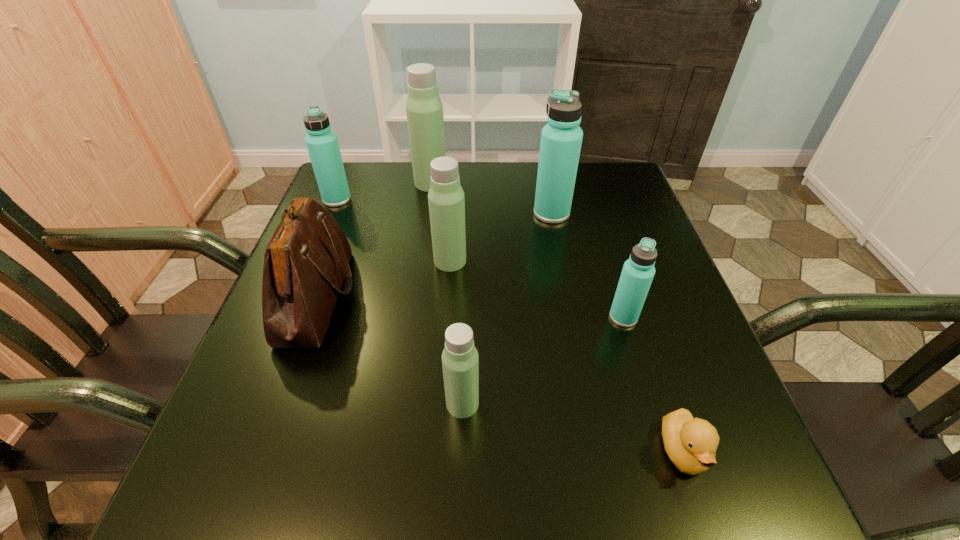
Locate an element on the screen. The image size is (960, 540). the smallest light thermos bottle is located at coordinates (460, 361).

Image resolution: width=960 pixels, height=540 pixels. Find the location of `the nearest thermos bottle`. the nearest thermos bottle is located at coordinates (460, 361).

Find the location of a particular element. This screenshot has width=960, height=540. duckling is located at coordinates (691, 443).

You are a GUI agent. You are given a task and a screenshot of the screen. Output one action in this format:
    pyautogui.click(x=<x>, y=<y>)
    Task: Click on the shortest object
    
    Given the screenshot: What is the action you would take?
    pyautogui.click(x=691, y=443)

Where is `vacant region located 0.290m on the right of the farthest light thermos bottle`? The width and height of the screenshot is (960, 540). vacant region located 0.290m on the right of the farthest light thermos bottle is located at coordinates (555, 183).

The image size is (960, 540). I want to click on free space located on the left of the second aqua thermos bottle from right to left, so click(x=510, y=213).

Identify the location of vacant space located 0.120m on the right of the leftmost aqua thermos bottle. (397, 199).

Identify the location of vacant space situated 0.080m on the left of the fourth farthest thermos bottle. Image resolution: width=960 pixels, height=540 pixels. (397, 261).

At what (x,y) coordinates should I click in order to perform the action: click on vacant space located on the back of the brown shoulder bag. Please return your answer as a coordinate pair (x, y). This screenshot has height=540, width=960. Looking at the image, I should click on (359, 181).

Image resolution: width=960 pixels, height=540 pixels. I want to click on blank space located on the right of the fifth farthest thermos bottle, so click(x=674, y=317).